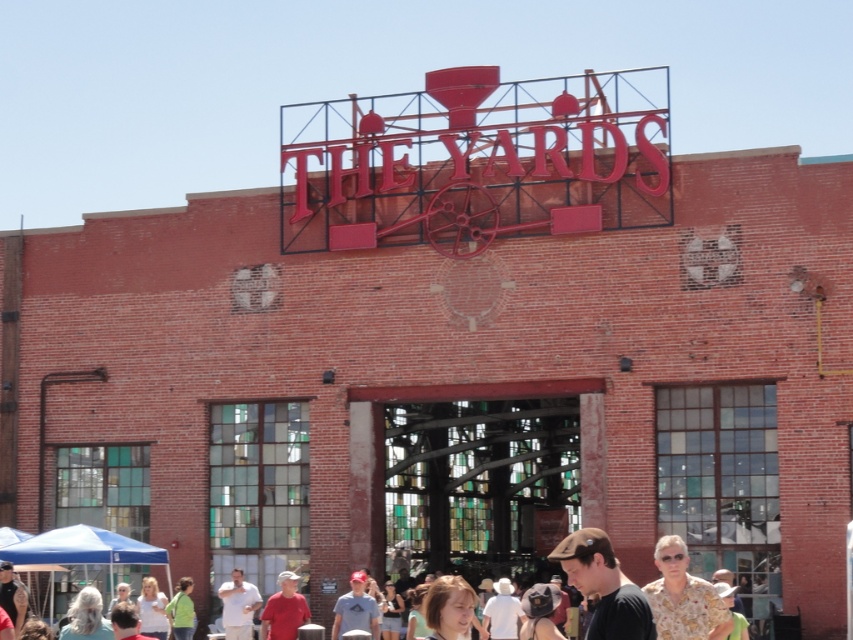
Question: Is brown cap at lower center behind matte gray cap at center?

Choices:
 (A) no
 (B) yes

Answer: (A)

Question: In this image, where is brown cap at lower center located relative to white matte shirt at lower center?

Choices:
 (A) above
 (B) below

Answer: (A)

Question: Estimate the real-world distances between objects in this image. Which object is closer to the floral shirt at lower right?

Choices:
 (A) matte gray cap at center
 (B) brown cap at lower center

Answer: (B)

Question: Is brown fabric shirt at lower center closer to camera compared to matte red cap at center?

Choices:
 (A) no
 (B) yes

Answer: (B)

Question: Which point is farther to the camera?

Choices:
 (A) floral shirt at lower right
 (B) white matte shirt at lower center

Answer: (B)

Question: Among these points, which one is nearest to the camera?

Choices:
 (A) (680, 627)
 (B) (227, 625)
 (C) (262, 611)

Answer: (A)